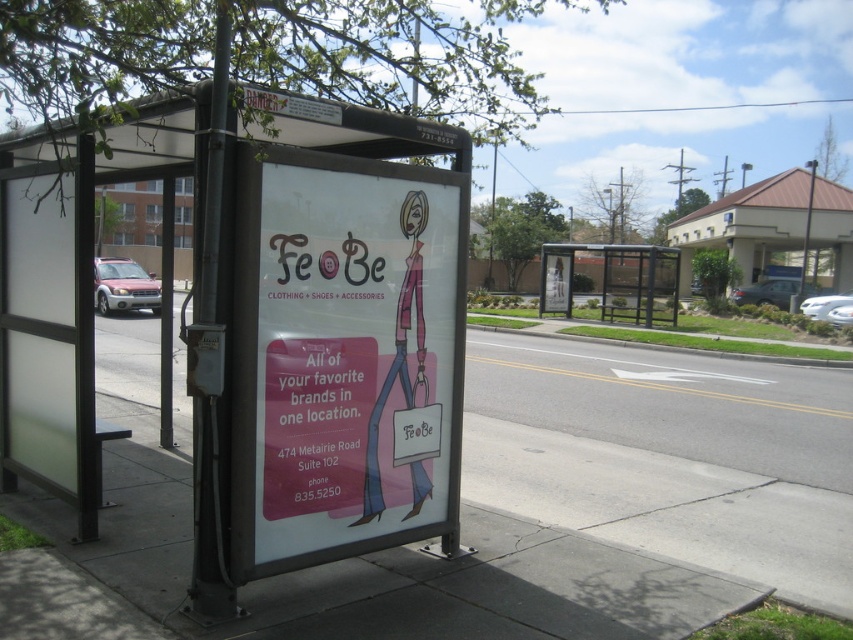
Question: Among these objects, which one is nearest to the camera?

Choices:
 (A) white frosted glass bus stop at left
 (B) matte pink poster at center
 (C) white concrete pavement at lower left

Answer: (A)

Question: Considering the real-world distances, which object is farthest from the metallic silver bus stop at center?

Choices:
 (A) matte pink poster at center
 (B) white frosted glass bus stop at left
 (C) white concrete pavement at lower left

Answer: (A)

Question: Among these objects, which one is farthest from the camera?

Choices:
 (A) white frosted glass bus stop at left
 (B) white concrete pavement at lower left

Answer: (B)

Question: Does white frosted glass bus stop at left have a lesser width compared to white concrete pavement at lower left?

Choices:
 (A) yes
 (B) no

Answer: (A)

Question: Is white concrete pavement at lower left positioned before metallic silver bus stop at center?

Choices:
 (A) yes
 (B) no

Answer: (A)

Question: Is the position of white concrete pavement at lower left less distant than that of metallic silver bus stop at center?

Choices:
 (A) yes
 (B) no

Answer: (A)